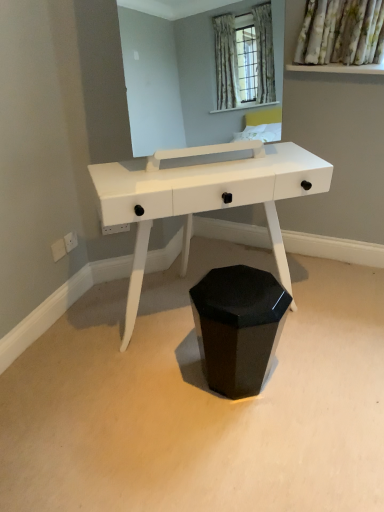
Question: Considering the positions of black glossy hexagonal waste bin at center and white glossy table at center in the image, is black glossy hexagonal waste bin at center wider or thinner than white glossy table at center?

Choices:
 (A) wide
 (B) thin

Answer: (B)

Question: Considering the positions of black glossy hexagonal waste bin at center and white glossy table at center in the image, is black glossy hexagonal waste bin at center taller or shorter than white glossy table at center?

Choices:
 (A) short
 (B) tall

Answer: (A)

Question: In the image, is black glossy hexagonal waste bin at center positioned in front of or behind white glossy table at center?

Choices:
 (A) behind
 (B) front

Answer: (A)

Question: From a real-world perspective, relative to black glossy hexagonal waste bin at center, is white glossy table at center vertically above or below?

Choices:
 (A) below
 (B) above

Answer: (B)

Question: Considering the positions of white glossy table at center and black glossy hexagonal waste bin at center in the image, is white glossy table at center taller or shorter than black glossy hexagonal waste bin at center?

Choices:
 (A) short
 (B) tall

Answer: (B)

Question: Which is correct: white glossy table at center is inside black glossy hexagonal waste bin at center, or outside of it?

Choices:
 (A) inside
 (B) outside

Answer: (B)

Question: Is point (231, 194) closer or farther from the camera than point (251, 339)?

Choices:
 (A) closer
 (B) farther

Answer: (A)